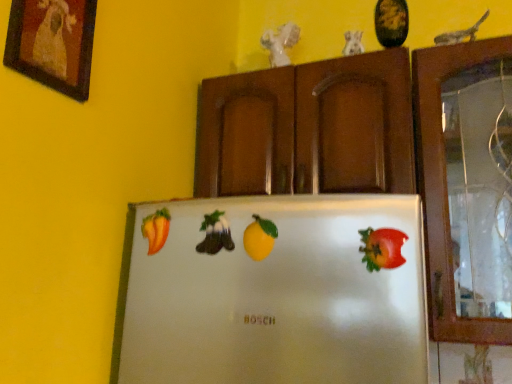
Question: Considering the positions of point (273, 236) and point (398, 251), is point (273, 236) closer or farther from the camera than point (398, 251)?

Choices:
 (A) closer
 (B) farther

Answer: (B)

Question: Based on their sizes in the image, would you say yellow matte lemon at center, the 3th fruit viewed from the back, is bigger or smaller than shiny red apple at right, the 4th fruit when ordered from left to right?

Choices:
 (A) small
 (B) big

Answer: (A)

Question: Which object is the farthest from the smooth orange pepper at left, which is counted as the 4th fruit, starting from the front?

Choices:
 (A) green matte bell pepper at center, the 2th fruit positioned from the left
 (B) wooden framed picture at upper left
 (C) shiny red apple at right, which ranks as the fourth fruit in back-to-front order
 (D) brown wood cabinetry at upper center
 (E) yellow matte lemon at center, which is the third fruit from left to right

Answer: (D)

Question: Which of these objects is positioned closest to the wooden framed picture at upper left?

Choices:
 (A) smooth orange pepper at left, the first fruit from the left
 (B) brown wood cabinetry at upper center
 (C) shiny red apple at right, acting as the first fruit starting from the right
 (D) yellow matte lemon at center, the 3th fruit viewed from the back
 (E) green matte bell pepper at center, the third fruit viewed from the front

Answer: (A)